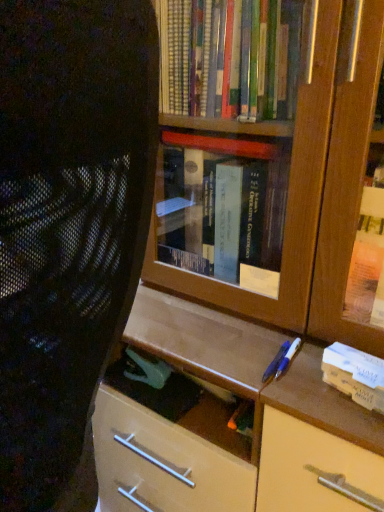
Where is `white cardboard book at right`? white cardboard book at right is located at coordinates (355, 375).

What do you see at coordinates (355, 375) in the screenshot?
I see `white cardboard book at right` at bounding box center [355, 375].

Measure the distance between point (86, 250) and camera.

Point (86, 250) and camera are 47.00 centimeters apart from each other.

Where is `black mesh chair at left`? Image resolution: width=384 pixels, height=512 pixels. black mesh chair at left is located at coordinates (68, 228).

What do you see at coordinates (68, 228) in the screenshot?
I see `black mesh chair at left` at bounding box center [68, 228].

The height and width of the screenshot is (512, 384). Find the location of `white cardboard book at right`. white cardboard book at right is located at coordinates (355, 375).

Is black mesh chair at left to the left of white cardboard book at right from the viewer's perspective?

Yes, black mesh chair at left is to the left of white cardboard book at right.

Is black mesh chair at left behind white cardboard book at right?

No, black mesh chair at left is closer to the camera.

Considering the positions of points (136, 169) and (347, 346), is point (136, 169) closer to camera compared to point (347, 346)?

Yes, it is in front of point (347, 346).

From the image's perspective, is black mesh chair at left positioned above or below white cardboard book at right?

black mesh chair at left is above white cardboard book at right.

From a real-world perspective, relative to white cardboard book at right, is black mesh chair at left vertically above or below?

In terms of real-world spatial position, black mesh chair at left is above white cardboard book at right.

Looking at their sizes, would you say black mesh chair at left is wider or thinner than white cardboard book at right?

black mesh chair at left is wider than white cardboard book at right.

Is black mesh chair at left taller or shorter than white cardboard book at right?

Considering their sizes, black mesh chair at left has more height than white cardboard book at right.

Does black mesh chair at left have a smaller size compared to white cardboard book at right?

No, black mesh chair at left is not smaller than white cardboard book at right.

Would you say black mesh chair at left is outside white cardboard book at right?

black mesh chair at left lies outside white cardboard book at right's area.

Is black mesh chair at left far away from white cardboard book at right?

That's not correct — black mesh chair at left is a little close to white cardboard book at right.

Is black mesh chair at left facing away from white cardboard book at right?

No, black mesh chair at left's orientation is not away from white cardboard book at right.

How many degrees apart are the facing directions of black mesh chair at left and white cardboard book at right?

They differ by 81.9 degrees in their facing directions.

Locate an element on the screen. This screenshot has width=384, height=512. paperback book that appears below the black mesh chair at left (from a real-world perspective) is located at coordinates (355, 375).

Which is more to the right, white cardboard book at right or black mesh chair at left?

white cardboard book at right.

Consider the image. Considering the relative positions of white cardboard book at right and black mesh chair at left in the image provided, is white cardboard book at right behind black mesh chair at left?

Yes, white cardboard book at right is further from the viewer.

Does point (361, 362) lie behind point (3, 28)?

Yes, it is.

Looking at this image, from the image's perspective, which one is positioned lower, white cardboard book at right or black mesh chair at left?

white cardboard book at right is shown below in the image.

From the picture: From a real-world perspective, is white cardboard book at right physically located above or below black mesh chair at left?

In terms of real-world spatial position, white cardboard book at right is below black mesh chair at left.

Considering the sizes of white cardboard book at right and black mesh chair at left in the image, is white cardboard book at right wider or thinner than black mesh chair at left?

Clearly, white cardboard book at right has less width compared to black mesh chair at left.

Which of these two, white cardboard book at right or black mesh chair at left, stands shorter?

white cardboard book at right is shorter.

Considering the sizes of objects white cardboard book at right and black mesh chair at left in the image provided, who is bigger, white cardboard book at right or black mesh chair at left?

With larger size is black mesh chair at left.

Is white cardboard book at right not within black mesh chair at left?

Absolutely, white cardboard book at right is external to black mesh chair at left.

Would you say white cardboard book at right is a long distance from black mesh chair at left?

white cardboard book at right is near black mesh chair at left, not far away.

Does white cardboard book at right turn towards black mesh chair at left?

No, white cardboard book at right is not aimed at black mesh chair at left.

Measure the distance from white cardboard book at right to black mesh chair at left.

The distance of white cardboard book at right from black mesh chair at left is 17.90 inches.

Locate an element on the screen. This screenshot has width=384, height=512. paperback book below the black mesh chair at left (from the image's perspective) is located at coordinates (355, 375).

Locate an element on the screen. The width and height of the screenshot is (384, 512). paperback book lying below the black mesh chair at left (from the image's perspective) is located at coordinates (355, 375).

Where is `person on the left side of white cardboard book at right`? The image size is (384, 512). person on the left side of white cardboard book at right is located at coordinates (68, 228).